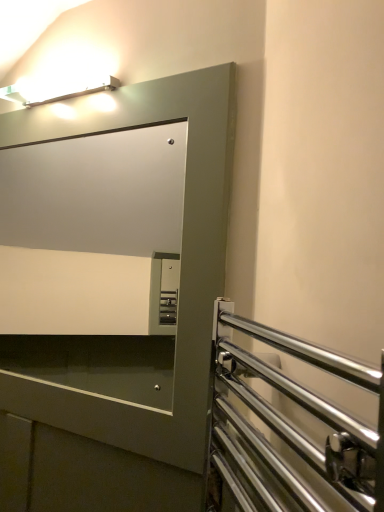
Describe the element at coordinates (127, 338) in the screenshot. I see `matte gray door at upper left` at that location.

The height and width of the screenshot is (512, 384). I want to click on matte gray door at upper left, so click(127, 338).

This screenshot has height=512, width=384. I want to click on matte gray door at upper left, so click(127, 338).